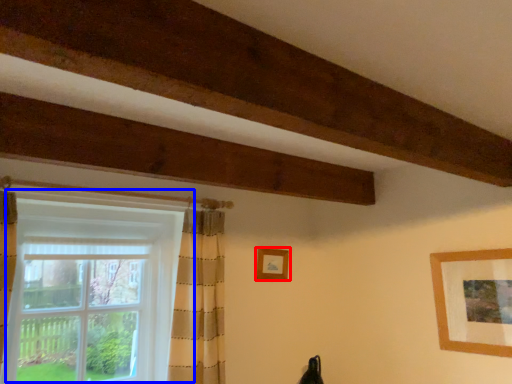
Question: Among these objects, which one is nearest to the camera, picture frame (highlighted by a red box) or window (highlighted by a blue box)?

Choices:
 (A) picture frame
 (B) window

Answer: (B)